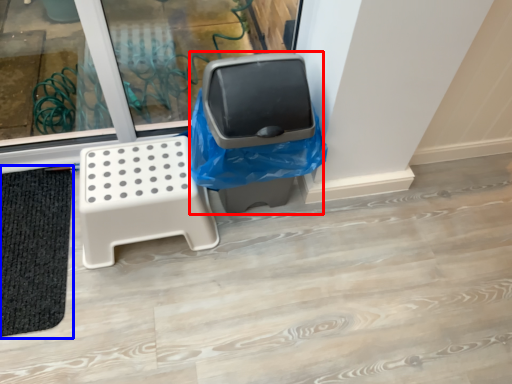
Question: Which object is further to the camera taking this photo, garbage (highlighted by a red box) or bath mat (highlighted by a blue box)?

Choices:
 (A) garbage
 (B) bath mat

Answer: (B)